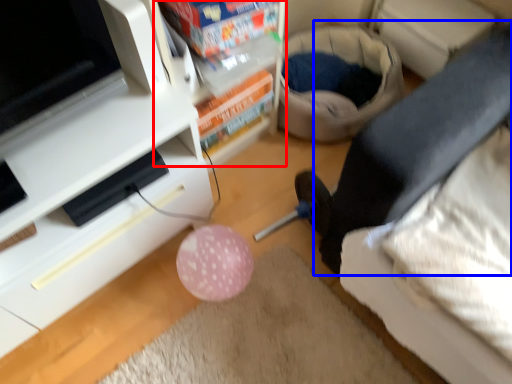
Question: Which object is closer to the camera taking this photo, shelf (highlighted by a red box) or leg (highlighted by a blue box)?

Choices:
 (A) shelf
 (B) leg

Answer: (A)